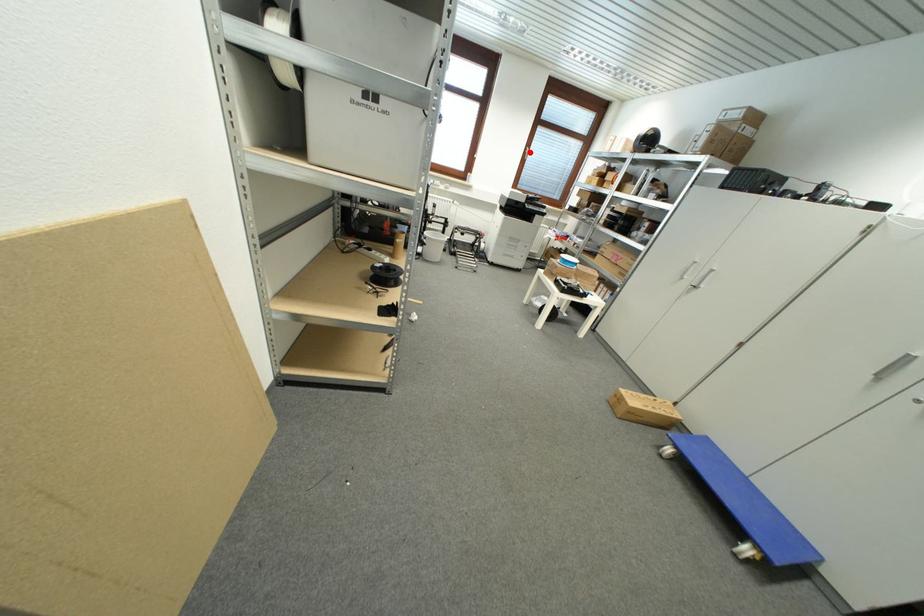
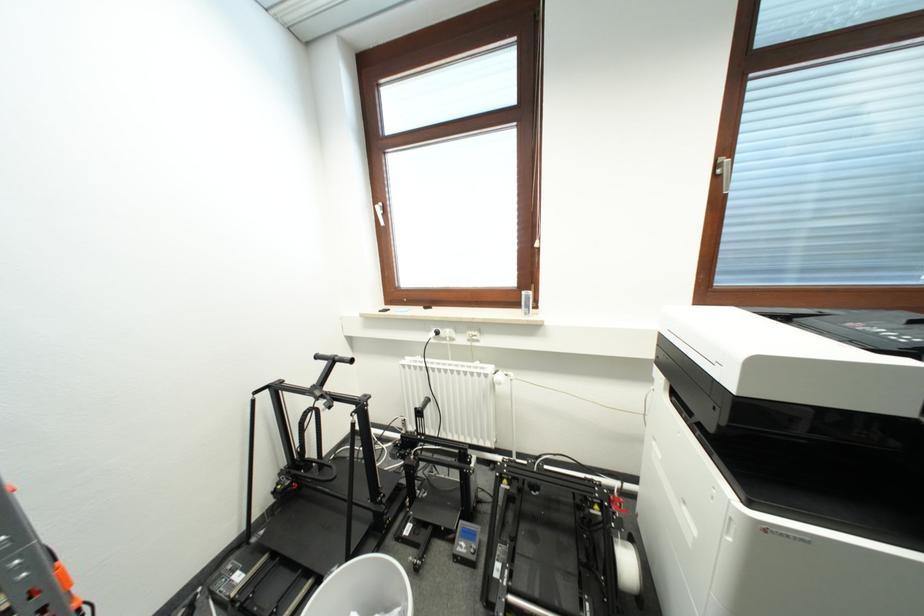
Find the pixel in the second image that matches the highlighted location in the first image.

(721, 169)